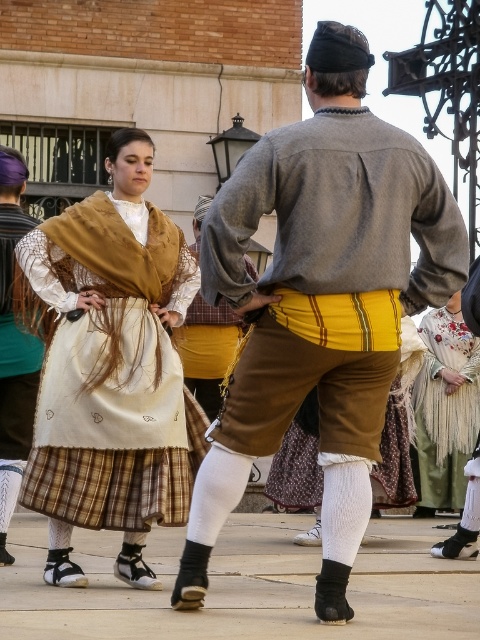
Can you confirm if matte brown fabric dress at center is shorter than yellow cotton shirt at center?

No.

Which is in front, point (132, 445) or point (219, 392)?

Point (132, 445)

Is point (76, 406) positioned behind point (235, 323)?

No, it is not.

Find the location of a particular element. The width and height of the screenshot is (480, 640). matte brown fabric dress at center is located at coordinates (109, 368).

Which is more to the left, matte gray sweater at center or yellow cotton shirt at center?

yellow cotton shirt at center

Who is lower down, matte gray sweater at center or yellow cotton shirt at center?

yellow cotton shirt at center is lower down.

Is point (352, 282) positioned in front of point (199, 228)?

Yes, point (352, 282) is closer to viewer.

Image resolution: width=480 pixels, height=640 pixels. I want to click on matte gray sweater at center, so click(x=321, y=301).

Is matte brown fabric dress at center to the left of matte brown leather belt at center from the viewer's perspective?

In fact, matte brown fabric dress at center is to the right of matte brown leather belt at center.

In the scene shown: Is matte brown fabric dress at center to the right of matte brown leather belt at center from the viewer's perspective?

Yes, matte brown fabric dress at center is to the right of matte brown leather belt at center.

Where is `matte brown fabric dress at center`? The width and height of the screenshot is (480, 640). matte brown fabric dress at center is located at coordinates (109, 368).

Locate an element on the screen. The image size is (480, 640). matte brown fabric dress at center is located at coordinates (109, 368).